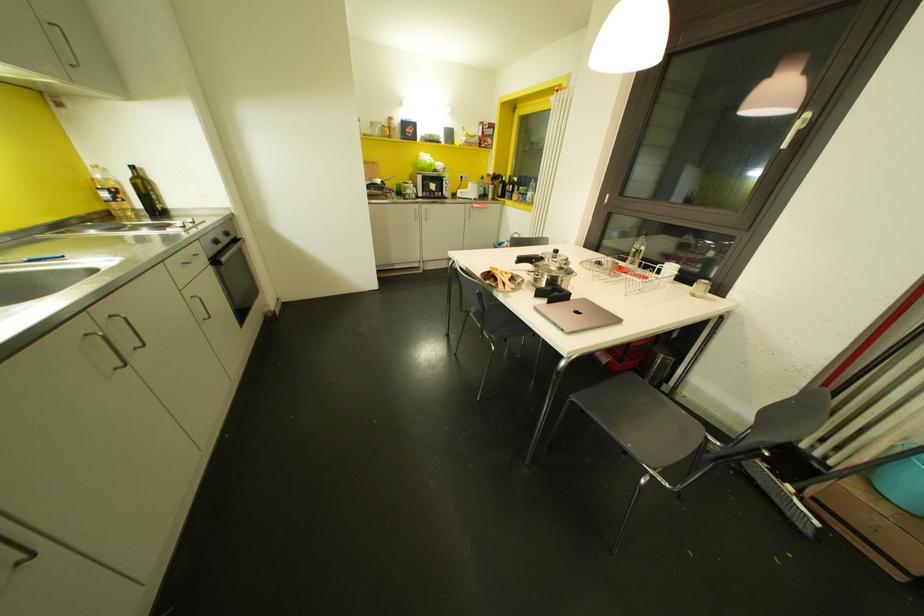
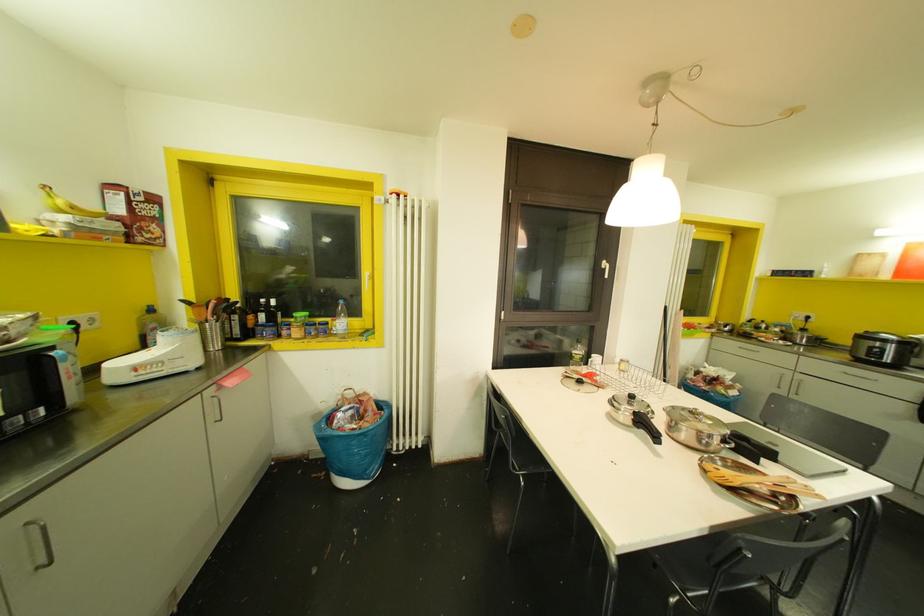
In the second image, find the point that corresponds to point 457,195 in the first image.

(116, 378)